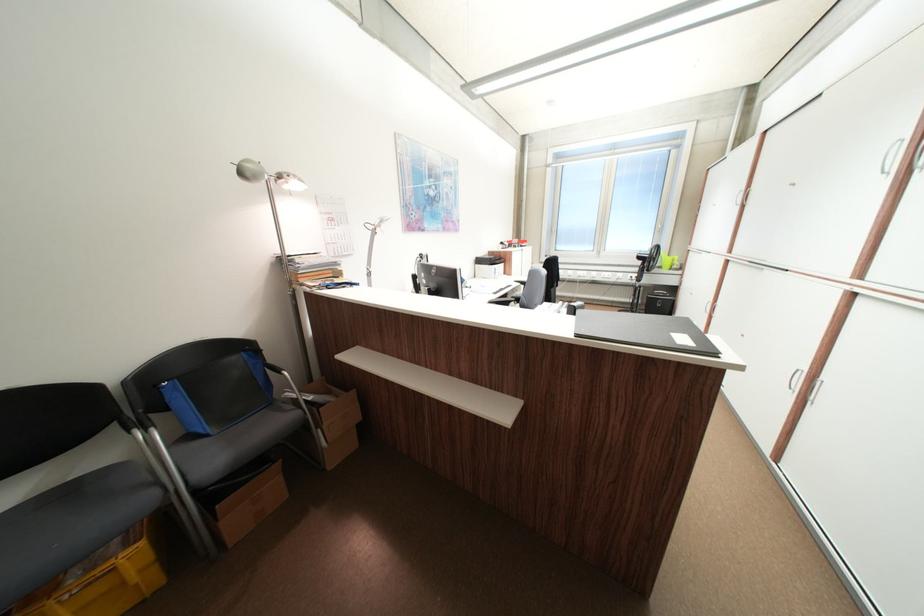
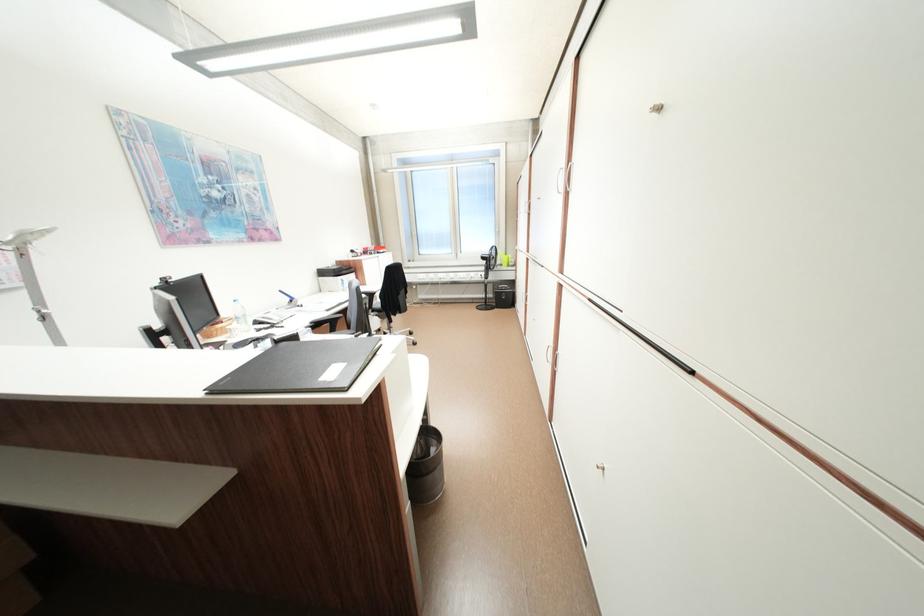
In the second image, find the point that corresponds to (x=649, y=257) in the first image.

(492, 259)